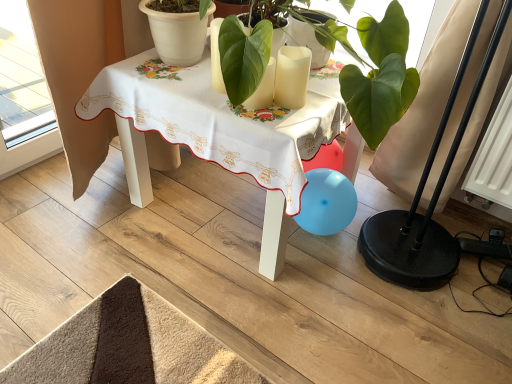
Locate an element on the screen. Image resolution: width=512 pixels, height=384 pixels. vacant area that is in front of white matte flowerpot at upper center is located at coordinates (174, 80).